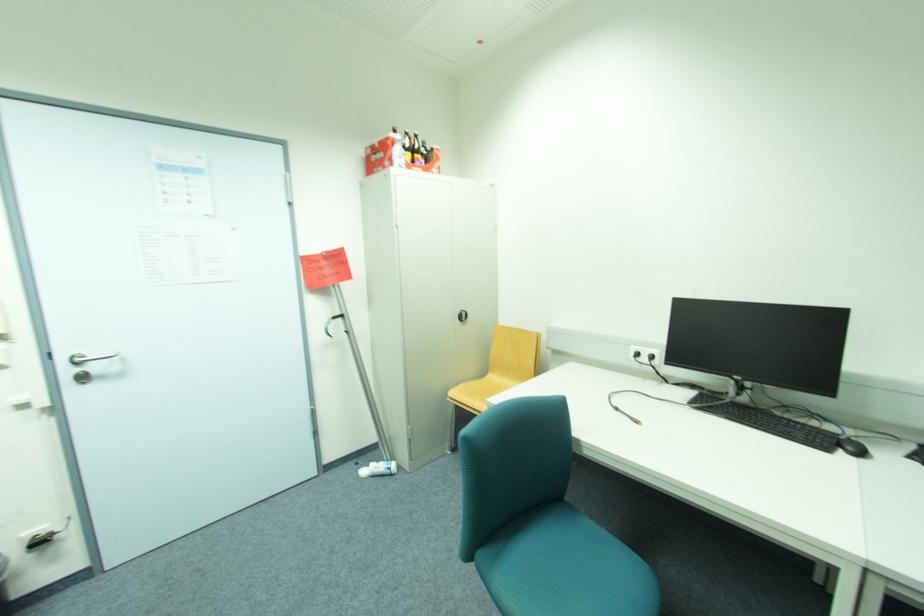
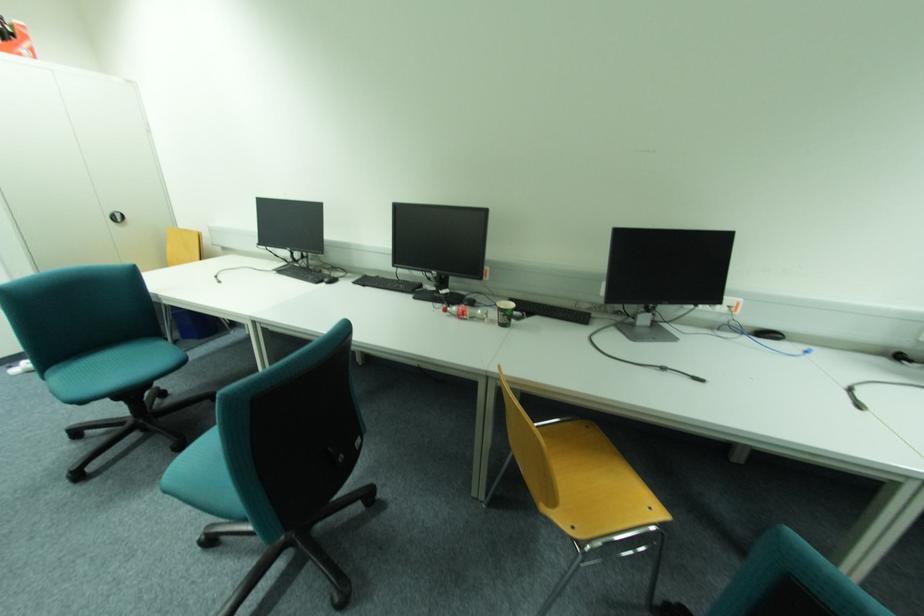
The point at (468,317) is marked in the first image. Where is the corresponding point in the second image?

(126, 219)